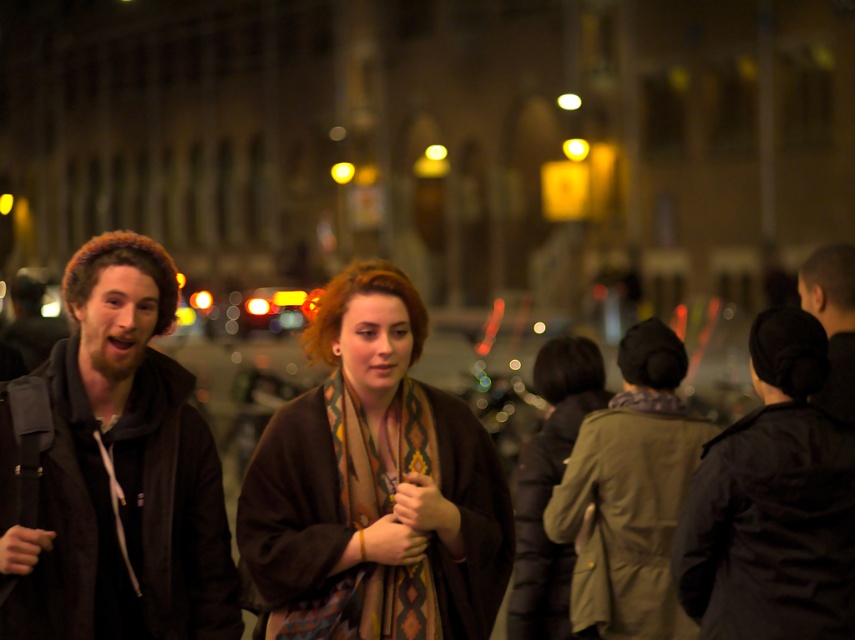
This screenshot has width=855, height=640. What are the coordinates of `brown wool coat at center` in the screenshot? It's located at (110, 467).

In the scene shown: Can you confirm if brown wool coat at center is shorter than black matte jacket at center?

No, brown wool coat at center is not shorter than black matte jacket at center.

Who is more forward, (59, 440) or (805, 568)?

Positioned in front is point (59, 440).

Where is `brown wool coat at center`? The height and width of the screenshot is (640, 855). brown wool coat at center is located at coordinates (110, 467).

Is brown woolen coat at center thinner than dark brown leather jacket at left?

In fact, brown woolen coat at center might be wider than dark brown leather jacket at left.

Is point (447, 586) positioned after point (139, 577)?

Yes.

Is point (310, 525) positioned behind point (219, 506)?

No, it is in front of (219, 506).

Image resolution: width=855 pixels, height=640 pixels. I want to click on brown woolen coat at center, so click(376, 483).

Between brown woolen coat at center and black matte jacket at center, which one has less height?

With less height is black matte jacket at center.

Is point (408, 282) behind point (794, 472)?

Yes, it is behind point (794, 472).

I want to click on brown woolen coat at center, so click(x=376, y=483).

You are a GUI agent. You are given a task and a screenshot of the screen. Output one action in this format:
    pyautogui.click(x=<x>, y=<y>)
    Task: Click on the brown woolen coat at center
    The height and width of the screenshot is (640, 855).
    Given the screenshot: What is the action you would take?
    pyautogui.click(x=376, y=483)